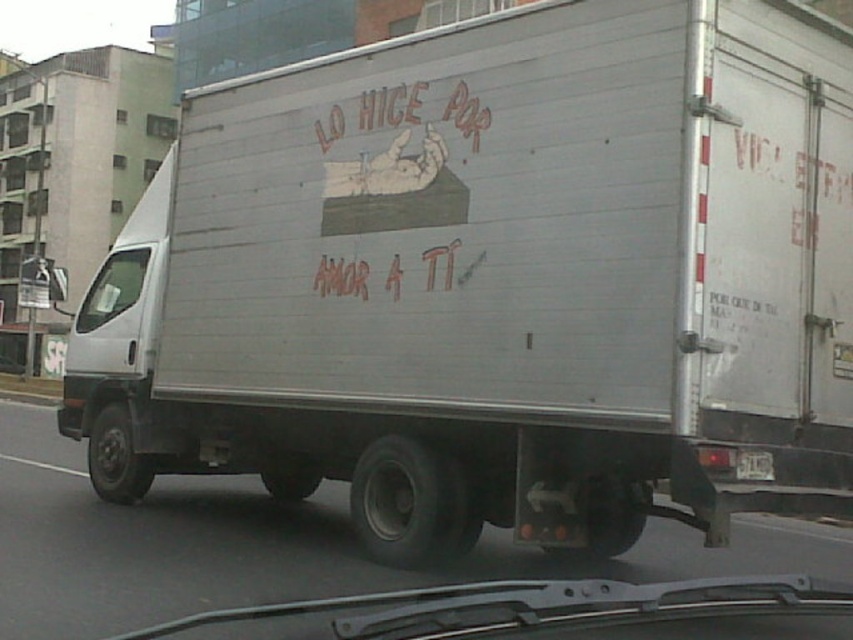
Does transparent glass windshield at left have a lesser height compared to white plastic license plate at center?

Incorrect, transparent glass windshield at left's height does not fall short of white plastic license plate at center's.

Which of these two, transparent glass windshield at left or white plastic license plate at center, stands shorter?

Standing shorter between the two is white plastic license plate at center.

Which is behind, point (77, 324) or point (764, 465)?

Point (77, 324)

You are a GUI agent. You are given a task and a screenshot of the screen. Output one action in this format:
    pyautogui.click(x=<x>, y=<y>)
    Task: Click on the transparent glass windshield at left
    The image size is (853, 640).
    Given the screenshot: What is the action you would take?
    pyautogui.click(x=112, y=289)